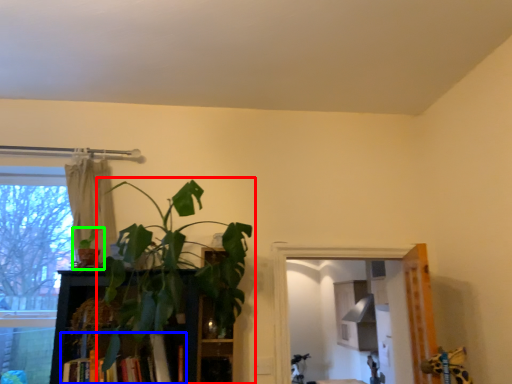
Question: Which object is positioned farthest from houseplant (highlighted by a red box)? Select from book (highlighted by a blue box) and houseplant (highlighted by a green box).

Choices:
 (A) book
 (B) houseplant

Answer: (B)